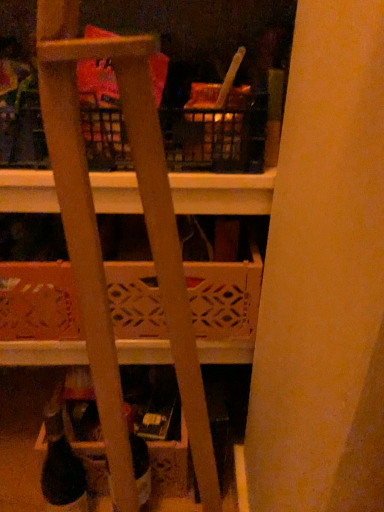
Question: Is wooden lattice basket at center at the left side of black matte wine bottle at lower left?

Choices:
 (A) yes
 (B) no

Answer: (B)

Question: Can you confirm if wooden lattice basket at center is positioned to the right of black matte wine bottle at lower left?

Choices:
 (A) no
 (B) yes

Answer: (B)

Question: Is wooden lattice basket at center positioned beyond the bounds of black matte wine bottle at lower left?

Choices:
 (A) no
 (B) yes

Answer: (B)

Question: Is wooden lattice basket at center aimed at black matte wine bottle at lower left?

Choices:
 (A) yes
 (B) no

Answer: (B)

Question: Considering the relative sizes of wooden lattice basket at center and black matte wine bottle at lower left in the image provided, is wooden lattice basket at center shorter than black matte wine bottle at lower left?

Choices:
 (A) yes
 (B) no

Answer: (A)

Question: From the image's perspective, would you say wooden lattice basket at center is shown under black matte wine bottle at lower left?

Choices:
 (A) no
 (B) yes

Answer: (A)

Question: Could you tell me if matte plastic bottle at lower center is turned towards wooden ladder at center?

Choices:
 (A) no
 (B) yes

Answer: (A)

Question: Is the position of matte plastic bottle at lower center less distant than that of wooden ladder at center?

Choices:
 (A) yes
 (B) no

Answer: (B)

Question: From a real-world perspective, is matte plastic bottle at lower center positioned under wooden ladder at center based on gravity?

Choices:
 (A) no
 (B) yes

Answer: (B)

Question: Is matte plastic bottle at lower center surrounding wooden ladder at center?

Choices:
 (A) no
 (B) yes

Answer: (A)

Question: Is matte plastic bottle at lower center bigger than wooden ladder at center?

Choices:
 (A) no
 (B) yes

Answer: (A)

Question: Considering the relative sizes of matte plastic bottle at lower center and wooden ladder at center in the image provided, is matte plastic bottle at lower center shorter than wooden ladder at center?

Choices:
 (A) yes
 (B) no

Answer: (A)

Question: Considering the relative sizes of matte plastic bottle at lower center and black matte wine bottle at lower left in the image provided, is matte plastic bottle at lower center thinner than black matte wine bottle at lower left?

Choices:
 (A) no
 (B) yes

Answer: (A)